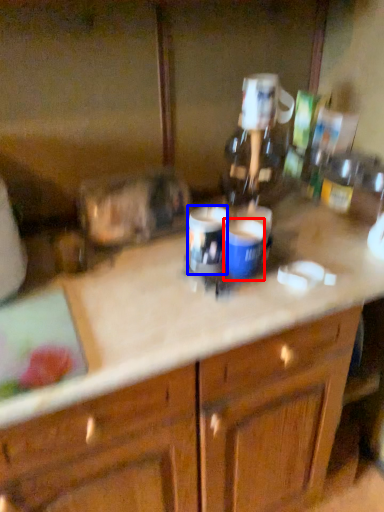
Question: Which point is further to the camera, beverage (highlighted by a red box) or beverage (highlighted by a blue box)?

Choices:
 (A) beverage
 (B) beverage

Answer: (B)